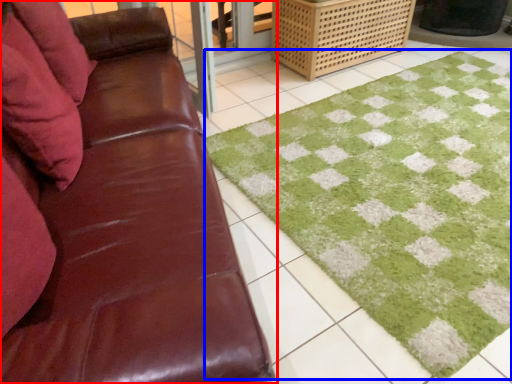
Question: Which object appears farthest to the camera in this image, studio couch (highlighted by a red box) or bath mat (highlighted by a blue box)?

Choices:
 (A) studio couch
 (B) bath mat

Answer: (B)